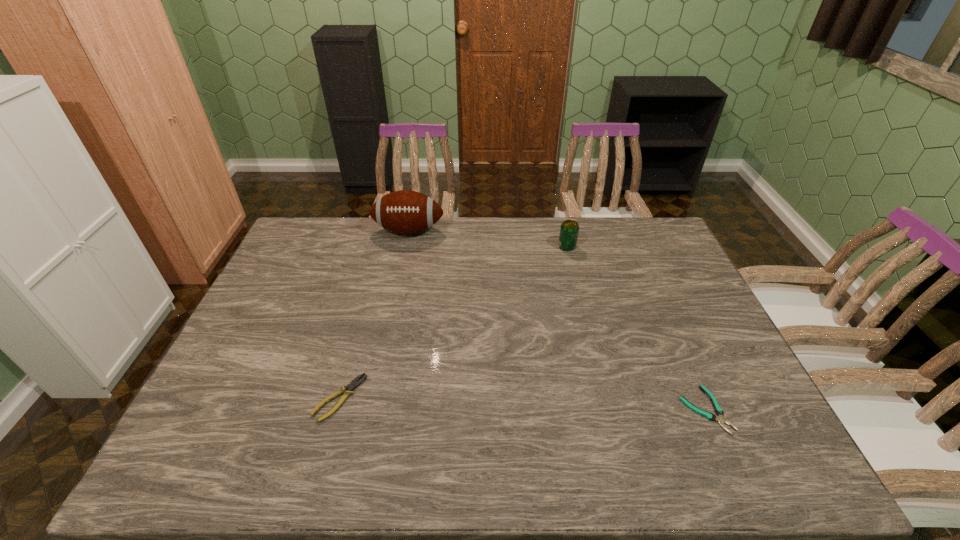
The image size is (960, 540). In order to click on free area in between the right pliers and the tallest object in this screenshot , I will do `click(557, 320)`.

Locate an element on the screen. The image size is (960, 540). free point between the rightmost object and the tallest object is located at coordinates click(x=557, y=320).

Where is `vacant area between the left pliers and the tallest object`? The width and height of the screenshot is (960, 540). vacant area between the left pliers and the tallest object is located at coordinates (374, 314).

In order to click on unoccupied area between the football and the left pliers in this screenshot , I will do `click(374, 314)`.

Image resolution: width=960 pixels, height=540 pixels. I want to click on free space between the right pliers and the football, so click(557, 320).

At what (x,y) coordinates should I click in order to perform the action: click on free space between the third tallest object and the tallest object. Please return your answer as a coordinate pair (x, y). The height and width of the screenshot is (540, 960). Looking at the image, I should click on (374, 314).

Locate an element on the screen. vacant point located between the football and the left pliers is located at coordinates (374, 314).

You are a GUI agent. You are given a task and a screenshot of the screen. Output one action in this format:
    pyautogui.click(x=<x>, y=<y>)
    Task: Click on the free space between the tallest object and the left pliers
    Image resolution: width=960 pixels, height=540 pixels.
    Given the screenshot: What is the action you would take?
    pyautogui.click(x=374, y=314)

Locate an element on the screen. This screenshot has height=540, width=960. vacant space in between the third shortest object and the shorter pliers is located at coordinates (636, 328).

In order to click on object that ranks as the closest to the right pliers in this screenshot , I will do `click(569, 229)`.